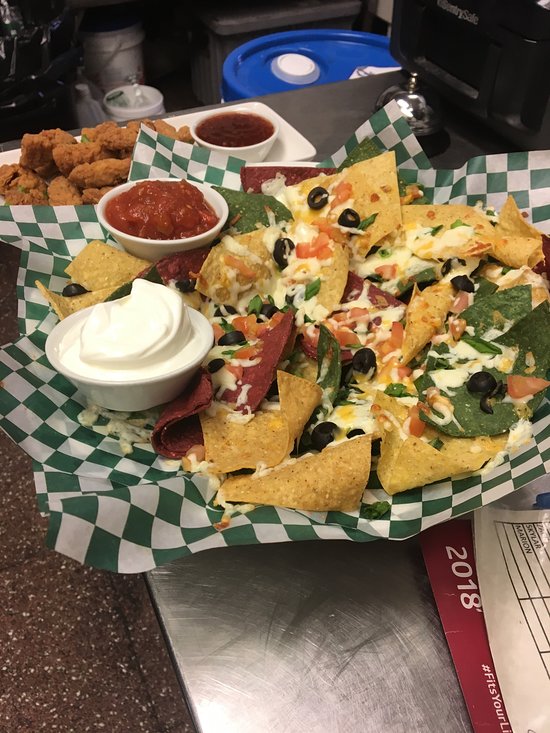
Find the location of `rectangular white plate`. rectangular white plate is located at coordinates (283, 151).